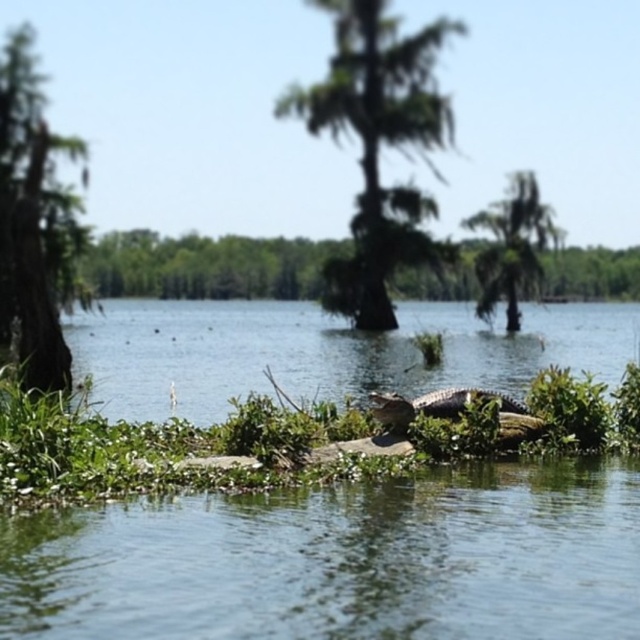
You are a kayaker planning to navigate through the scene. You see the greenish water at center and the green leafy tree at upper right. Which one would you prioritize for your route planning, and why?

The greenish water at center should be prioritized for route planning because it has a larger size compared to the green leafy tree at upper right, indicating it might be the main navigable area.

You are a kayaker planning to navigate through the greenish water at center and the green rough bark tree at left. Based on the scene, which object is shorter?

The greenish water at center has a lesser height compared to the green rough bark tree at left, so the greenish water at center is shorter.

You are standing at the edge of the water and want to cross to the small island. The coordinates of the island are at point (324, 352). Is the greenish water at center located at the same point as the island?

The greenish water at center is located at point (324, 352), which matches the coordinates of the island, so yes, the greenish water at center is at the same point as the island.